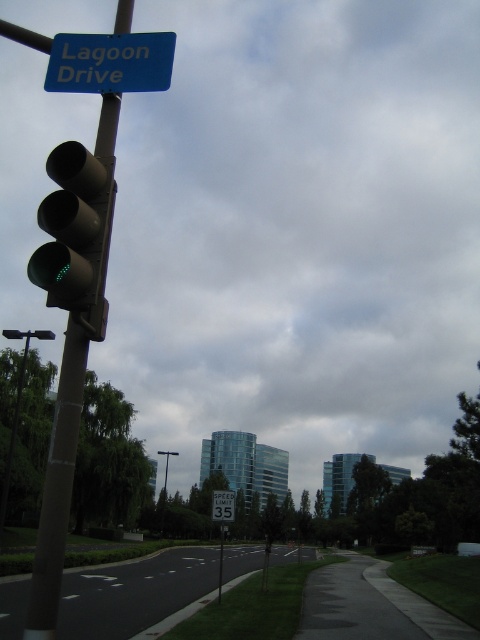
Question: Can you confirm if green matte traffic light at left is wider than blue plastic sign at upper center?

Choices:
 (A) no
 (B) yes

Answer: (B)

Question: Which is nearer to the metallic pole at center?

Choices:
 (A) metallic pole at left
 (B) blue plastic sign at upper center

Answer: (A)

Question: Does black asphalt road at lower center appear over white plastic speed limit sign at center?

Choices:
 (A) no
 (B) yes

Answer: (A)

Question: Can you confirm if green matte traffic light at left is positioned to the right of metallic pole at left?

Choices:
 (A) no
 (B) yes

Answer: (B)

Question: Which point is closer to the camera taking this photo?

Choices:
 (A) (99, 285)
 (B) (219, 518)
 (C) (160, 576)
 (D) (131, 83)

Answer: (A)

Question: Among these points, which one is farthest from the camera?

Choices:
 (A) (127, 584)
 (B) (217, 492)

Answer: (A)